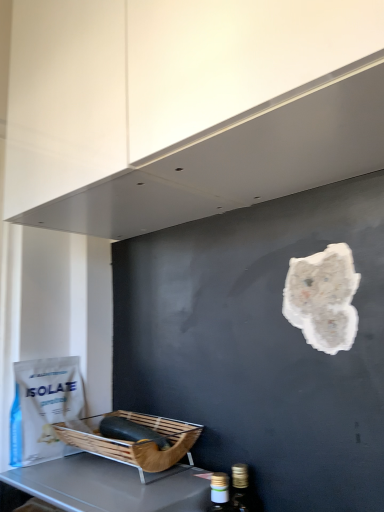
Find the location of `white matte paper bag at lower left`. white matte paper bag at lower left is located at coordinates (43, 408).

The width and height of the screenshot is (384, 512). Identify the location of white matte exhaust hood at upper center. (237, 161).

Is white matte paper bag at lower left aimed at brown woven basket at lower left?

Yes, white matte paper bag at lower left is oriented towards brown woven basket at lower left.

Considering the points (20, 408) and (149, 422), which point is in front, point (20, 408) or point (149, 422)?

The point (149, 422) is in front.

From the image's perspective, does white matte paper bag at lower left appear higher than brown woven basket at lower left?

Yes, from the image's perspective, white matte paper bag at lower left is over brown woven basket at lower left.

You are a GUI agent. You are given a task and a screenshot of the screen. Output one action in this format:
    pyautogui.click(x=<x>, y=<y>)
    Task: Click on the paper bag above the brown woven basket at lower left (from the image's perspective)
    
    Given the screenshot: What is the action you would take?
    pyautogui.click(x=43, y=408)

Is white matte exhaust hood at upper center turned away from wooden basket at lower left?

white matte exhaust hood at upper center does not have its back to wooden basket at lower left.

In order to click on exhaust hood in front of the wooden basket at lower left in this screenshot , I will do `click(237, 161)`.

Considering the relative sizes of white matte exhaust hood at upper center and wooden basket at lower left in the image provided, is white matte exhaust hood at upper center taller than wooden basket at lower left?

Yes, white matte exhaust hood at upper center is taller than wooden basket at lower left.

Looking at this image, from the image's perspective, is white matte exhaust hood at upper center located above wooden basket at lower left?

Indeed, from the image's perspective, white matte exhaust hood at upper center is shown above wooden basket at lower left.

Who is bigger, white matte paper bag at lower left or wooden basket at lower left?

Bigger between the two is wooden basket at lower left.

The image size is (384, 512). In order to click on furniture that is below the white matte paper bag at lower left (from the image's perspective) in this screenshot , I will do `click(109, 486)`.

Is point (40, 413) closer to camera compared to point (55, 474)?

No, (40, 413) is behind (55, 474).

Does wooden basket at lower left contain white matte paper bag at lower left?

No, white matte paper bag at lower left is located outside of wooden basket at lower left.

From the image's perspective, is wooden basket at lower left located above or below white matte paper bag at lower left?

wooden basket at lower left is below white matte paper bag at lower left.

Is point (144, 485) behind point (39, 378)?

No, (144, 485) is in front of (39, 378).

Which of these two, white matte exhaust hood at upper center or white matte paper bag at lower left, stands shorter?

white matte paper bag at lower left.

From the image's perspective, is white matte exhaust hood at upper center above white matte paper bag at lower left?

Correct, white matte exhaust hood at upper center appears higher than white matte paper bag at lower left in the image.

Is white matte paper bag at lower left inside white matte exhaust hood at upper center?

No, white matte exhaust hood at upper center does not contain white matte paper bag at lower left.

Is point (333, 173) closer to camera compared to point (65, 403)?

Yes, point (333, 173) is in front of point (65, 403).

Which object is more forward, white matte exhaust hood at upper center or brown woven basket at lower left?

white matte exhaust hood at upper center.

Between white matte exhaust hood at upper center and brown woven basket at lower left, which one has more height?

→ With more height is white matte exhaust hood at upper center.

Does white matte exhaust hood at upper center have a greater width compared to brown woven basket at lower left?

Indeed, white matte exhaust hood at upper center has a greater width compared to brown woven basket at lower left.

From the image's perspective, would you say white matte exhaust hood at upper center is positioned over brown woven basket at lower left?

Yes.

Does point (40, 389) appear closer or farther from the camera than point (139, 193)?

Point (40, 389) is farther from the camera than point (139, 193).

Can you confirm if white matte paper bag at lower left is smaller than white matte exhaust hood at upper center?

Correct, white matte paper bag at lower left occupies less space than white matte exhaust hood at upper center.

Which object is more forward, white matte paper bag at lower left or white matte exhaust hood at upper center?

white matte exhaust hood at upper center is closer to the camera.

Which is more to the right, white matte paper bag at lower left or white matte exhaust hood at upper center?

white matte exhaust hood at upper center is more to the right.

Identify the location of paper bag that is above the brown woven basket at lower left (from the image's perspective). The height and width of the screenshot is (512, 384). (43, 408).

Locate an element on the screen. The width and height of the screenshot is (384, 512). furniture below the white matte exhaust hood at upper center (from the image's perspective) is located at coordinates [109, 486].

From the image, which object appears to be nearer to brown woven basket at lower left, white matte exhaust hood at upper center or wooden basket at lower left?

wooden basket at lower left.

Looking at the image, which one is located closer to brown woven basket at lower left, white matte paper bag at lower left or wooden basket at lower left?

wooden basket at lower left lies closer to brown woven basket at lower left than the other object.

Which object lies nearer to the anchor point wooden basket at lower left, white matte exhaust hood at upper center or brown woven basket at lower left?

brown woven basket at lower left lies closer to wooden basket at lower left than the other object.

When comparing their distances from wooden basket at lower left, does brown woven basket at lower left or white matte paper bag at lower left seem further?

white matte paper bag at lower left is further to wooden basket at lower left.

Which object lies nearer to the anchor point white matte exhaust hood at upper center, white matte paper bag at lower left or brown woven basket at lower left?

The object closer to white matte exhaust hood at upper center is brown woven basket at lower left.

Looking at the image, which one is located further to white matte exhaust hood at upper center, white matte paper bag at lower left or wooden basket at lower left?

Based on the image, wooden basket at lower left appears to be further to white matte exhaust hood at upper center.

Considering their positions, is wooden basket at lower left positioned further to white matte paper bag at lower left than white matte exhaust hood at upper center?

white matte exhaust hood at upper center lies further to white matte paper bag at lower left than the other object.

Considering their positions, is wooden basket at lower left positioned further to brown woven basket at lower left than white matte paper bag at lower left?

white matte paper bag at lower left lies further to brown woven basket at lower left than the other object.

This screenshot has width=384, height=512. I want to click on paper bag between white matte exhaust hood at upper center and brown woven basket at lower left in the vertical direction, so click(43, 408).

Locate an element on the screen. basket located between wooden basket at lower left and white matte paper bag at lower left in the depth direction is located at coordinates (136, 443).

Locate an element on the screen. This screenshot has height=512, width=384. basket that lies between white matte exhaust hood at upper center and wooden basket at lower left from top to bottom is located at coordinates (136, 443).

The height and width of the screenshot is (512, 384). What are the coordinates of `paper bag that lies between white matte exhaust hood at upper center and wooden basket at lower left from top to bottom` in the screenshot? It's located at (43, 408).